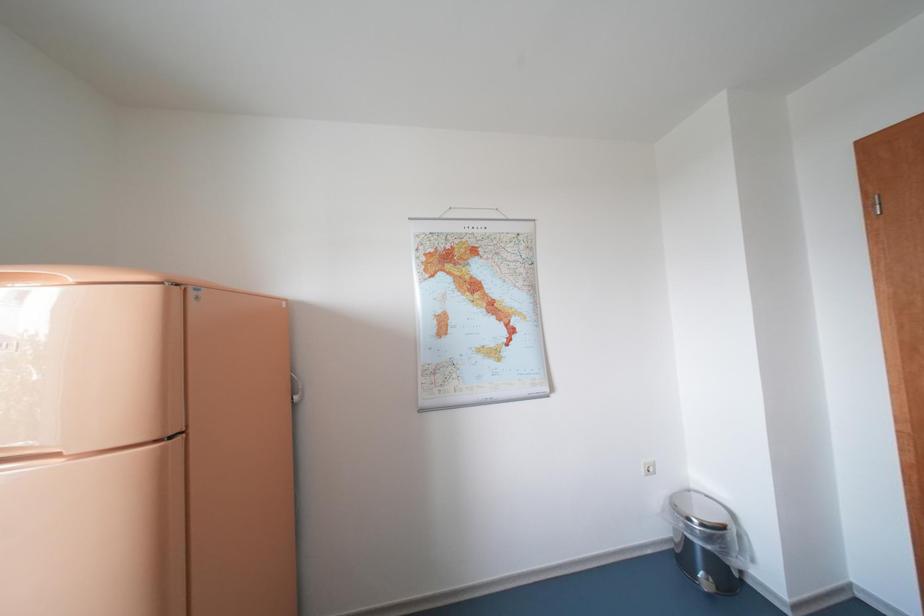
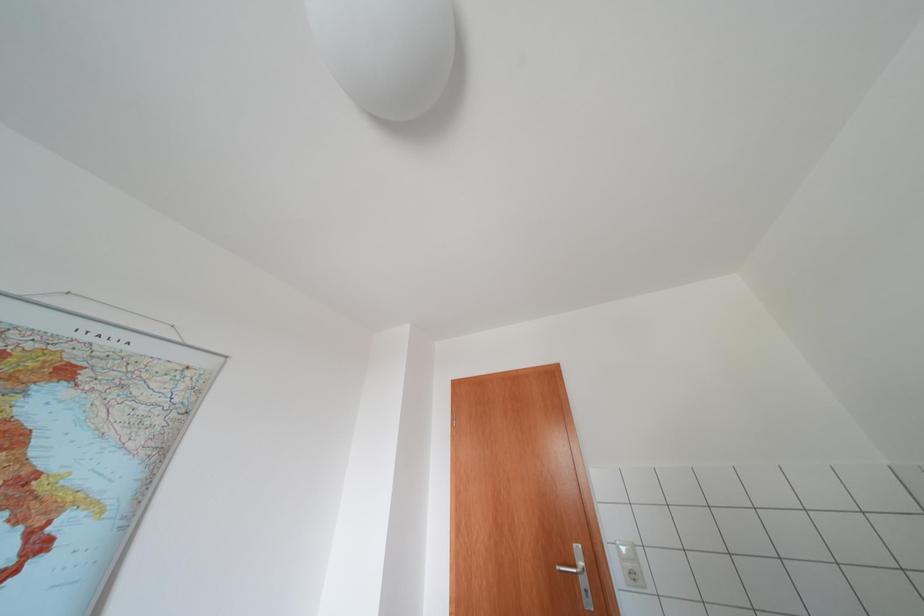
How did the camera likely rotate?

The camera's rotation is toward right-up.